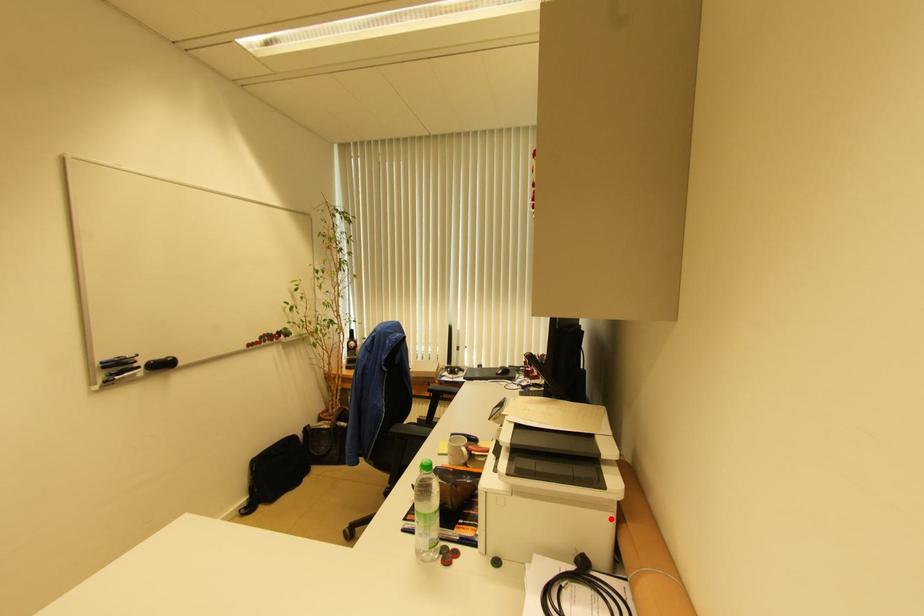
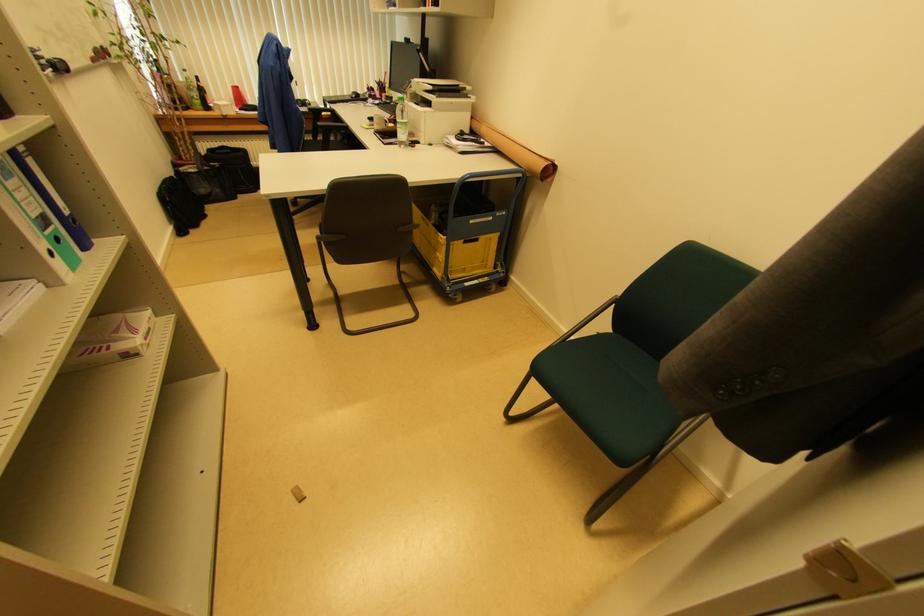
Question: I am providing you with two images of the same scene from different viewpoints. Image1 has a red point marked. In image2, the corresponding 3D location appears at what relative position? Reply with the corresponding letter.

Choices:
 (A) Closer
 (B) Farther

Answer: (A)